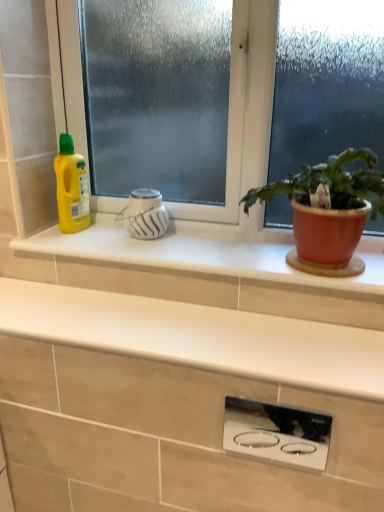
Locate an element on the screen. Image resolution: width=384 pixels, height=512 pixels. vacant space situated above white glossy window sill at center (from a real-world perspective) is located at coordinates (189, 244).